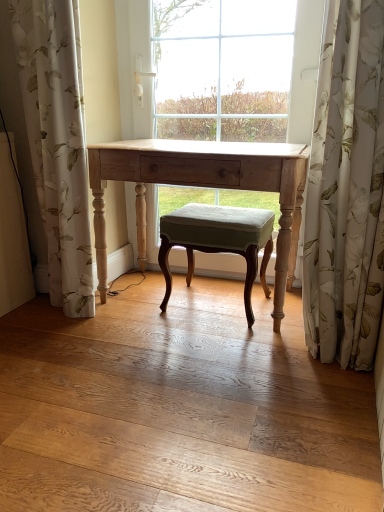
Question: Can you confirm if velvet green stool at center is smaller than white floral fabric at left, the 1th curtain when ordered from left to right?

Choices:
 (A) no
 (B) yes

Answer: (B)

Question: From a real-world perspective, is velvet green stool at center located higher than white floral fabric at left, the 1th curtain when ordered from left to right?

Choices:
 (A) no
 (B) yes

Answer: (A)

Question: Does velvet green stool at center lie behind white floral fabric at left, positioned as the second curtain in right-to-left order?

Choices:
 (A) no
 (B) yes

Answer: (B)

Question: Can you confirm if velvet green stool at center is taller than white floral fabric at left, positioned as the second curtain in right-to-left order?

Choices:
 (A) no
 (B) yes

Answer: (A)

Question: Is white floral fabric at left, positioned as the second curtain in right-to-left order, surrounded by velvet green stool at center?

Choices:
 (A) no
 (B) yes

Answer: (A)

Question: Considering the positions of velvet green stool at center and white floral fabric at right, which appears as the 1th curtain when viewed from the right, in the image, is velvet green stool at center wider or thinner than white floral fabric at right, which appears as the 1th curtain when viewed from the right,?

Choices:
 (A) wide
 (B) thin

Answer: (A)

Question: Based on their sizes in the image, would you say velvet green stool at center is bigger or smaller than white floral fabric at right, which appears as the 1th curtain when viewed from the right?

Choices:
 (A) big
 (B) small

Answer: (B)

Question: Considering their positions, is velvet green stool at center located in front of or behind white floral fabric at right, which appears as the 1th curtain when viewed from the right?

Choices:
 (A) front
 (B) behind

Answer: (B)

Question: In the image, is velvet green stool at center on the left side or the right side of white floral fabric at right, which appears as the 1th curtain when viewed from the right?

Choices:
 (A) left
 (B) right

Answer: (A)

Question: From the image's perspective, relative to light wood table at center, is white floral fabric at right, which is the 2th curtain from left to right, above or below?

Choices:
 (A) above
 (B) below

Answer: (A)

Question: In terms of width, does white floral fabric at right, which is the 2th curtain from left to right, look wider or thinner when compared to light wood table at center?

Choices:
 (A) thin
 (B) wide

Answer: (A)

Question: Considering the relative positions of white floral fabric at right, which is the 2th curtain from left to right, and light wood table at center in the image provided, is white floral fabric at right, which is the 2th curtain from left to right, to the left or to the right of light wood table at center?

Choices:
 (A) left
 (B) right

Answer: (B)

Question: Is white floral fabric at right, which is the 2th curtain from left to right, spatially inside light wood table at center, or outside of it?

Choices:
 (A) inside
 (B) outside

Answer: (B)

Question: Is light wood table at center to the left or to the right of white floral fabric at left, positioned as the second curtain in right-to-left order, in the image?

Choices:
 (A) right
 (B) left

Answer: (A)

Question: From a real-world perspective, is light wood table at center above or below white floral fabric at left, positioned as the second curtain in right-to-left order?

Choices:
 (A) below
 (B) above

Answer: (A)